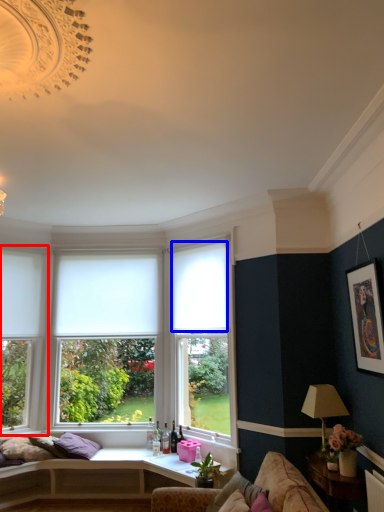
Question: Which point is closer to the camera, window (highlighted by a red box) or curtain (highlighted by a blue box)?

Choices:
 (A) window
 (B) curtain

Answer: (B)